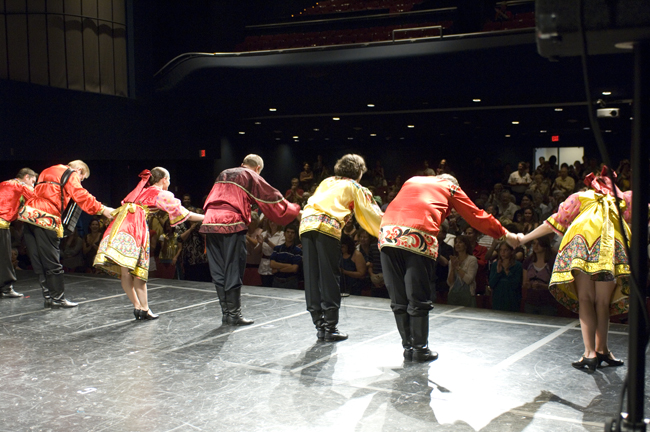
Identify the location of stage. The image size is (650, 432). (222, 410).